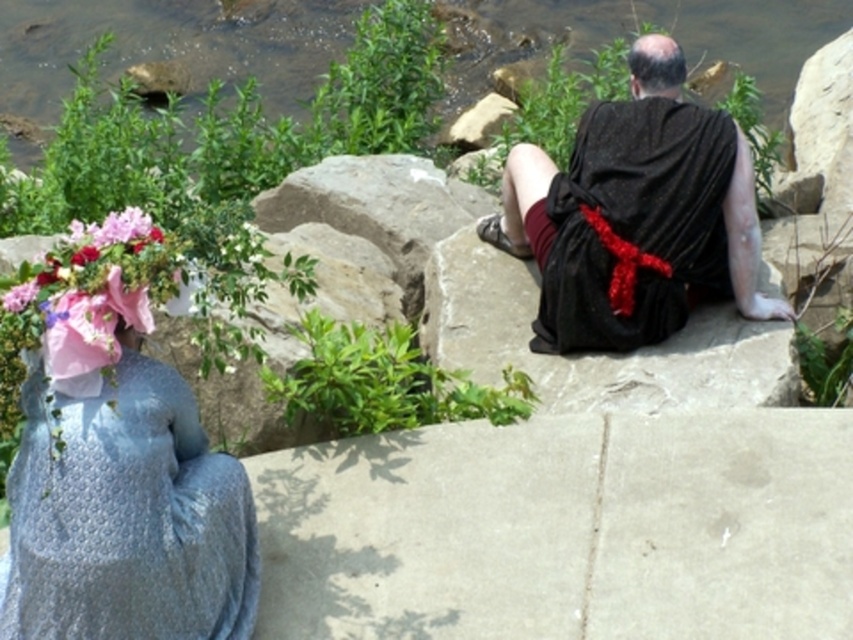
You are standing in front of a painting that shows two people on a rocky ledge by a river. There are two points marked in the image. The first point is at coordinates point [50,314] and the second is at point [662,61]. Which of these points is closer to you?

Point [50,314] is closer to the viewer than point [662,61].

You are a photographer trying to capture a group shot of the shiny blue dress at lower left and the black satin robe at upper right. The minimum distance required between the two subjects for your camera to focus properly is 5 feet. Can you take the photo without moving either subject?

The distance between the shiny blue dress at lower left and the black satin robe at upper right is 6.51 feet, which is greater than the minimum required 5 feet. Therefore, you can take the photo without moving either subject.

You are a photographer trying to capture a closeup of the bald head at upper center without including the pink fabric bouquet at left in the frame. Is this possible given their positions?

The pink fabric bouquet at left is positioned under the bald head at upper center, so tilting the camera upward slightly should allow you to frame the bald head without the bouquet appearing in the shot.